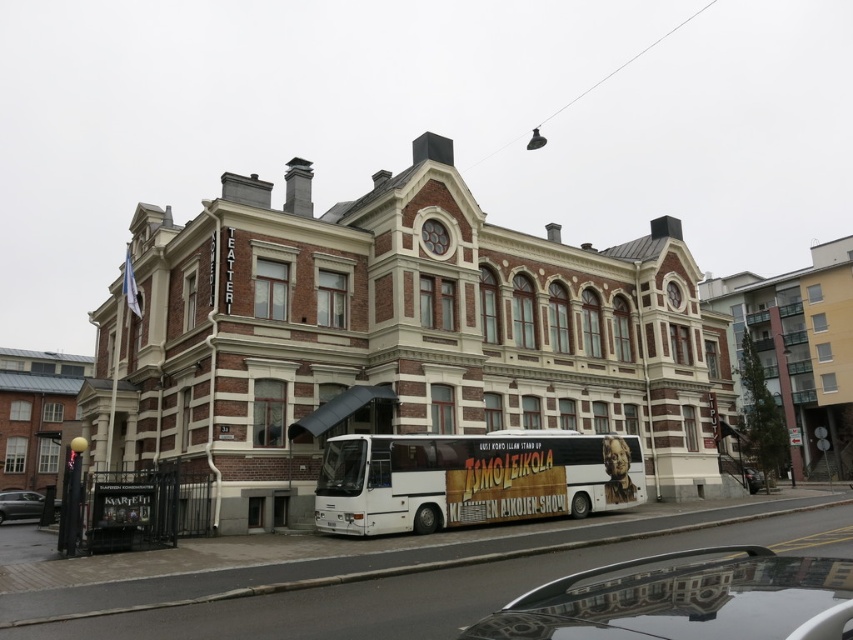
You are standing in front of the grand ornate building with the TEATTERI sign. You see a point marked at coordinates (685, 600). What object is located at that point?

The point at coordinates (685, 600) indicates a silver metallic car at center.

Consider the image. What are the coordinates of the silver metallic car at center?

The silver metallic car at center is located at coordinates point (685, 600).

You are standing at the entrance of the TEATTERI building and want to locate the white matte bus at lower center. According to the image coordinates, where exactly is it positioned?

The white matte bus at lower center is positioned at point coordinates of (469, 480).